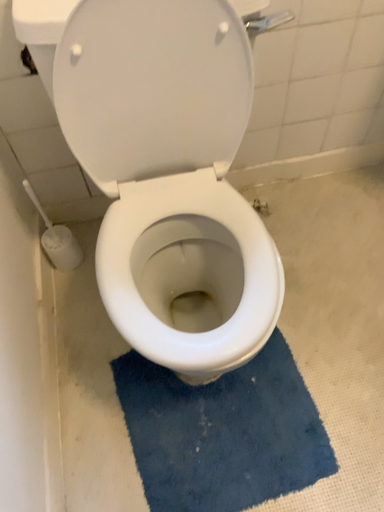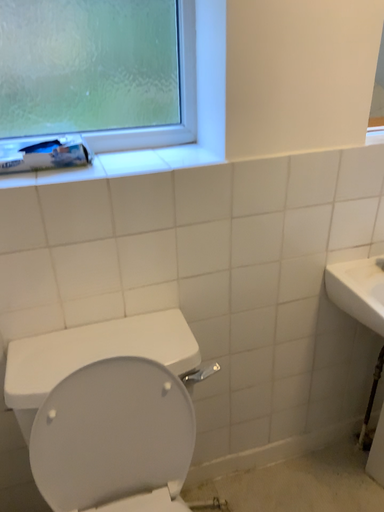
Question: How did the camera likely rotate when shooting the video?

Choices:
 (A) rotated downward
 (B) rotated upward

Answer: (B)